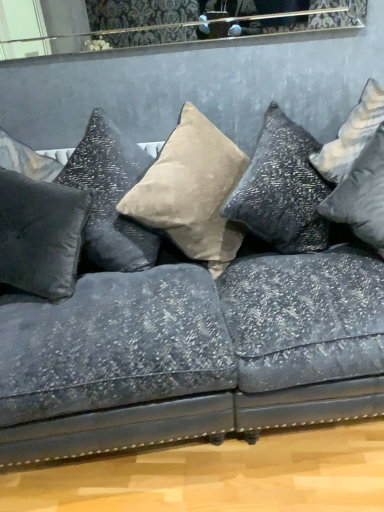
Question: Which direction should I rotate to look at suede beige pillow at center, which is counted as the third pillow, starting from the left?

Choices:
 (A) right
 (B) left

Answer: (B)

Question: Could satin black pillow at center, arranged as the 3th pillow when viewed from the right, be considered to be inside satin black pillow at left, which is counted as the first pillow, starting from the left?

Choices:
 (A) no
 (B) yes

Answer: (A)

Question: From the image's perspective, is satin black pillow at left, the fourth pillow in the right-to-left sequence, on satin black pillow at center, arranged as the 3th pillow when viewed from the right?

Choices:
 (A) yes
 (B) no

Answer: (B)

Question: Is satin black pillow at left, which is counted as the first pillow, starting from the left, smaller than satin black pillow at center, the 2th pillow when ordered from left to right?

Choices:
 (A) yes
 (B) no

Answer: (A)

Question: Can you confirm if satin black pillow at left, the fourth pillow in the right-to-left sequence, is thinner than satin black pillow at center, arranged as the 3th pillow when viewed from the right?

Choices:
 (A) no
 (B) yes

Answer: (B)

Question: Does satin black pillow at left, the fourth pillow in the right-to-left sequence, have a lesser height compared to satin black pillow at center, the 2th pillow when ordered from left to right?

Choices:
 (A) yes
 (B) no

Answer: (A)

Question: Is satin black pillow at left, which is counted as the first pillow, starting from the left, oriented away from satin black pillow at center, arranged as the 3th pillow when viewed from the right?

Choices:
 (A) no
 (B) yes

Answer: (B)

Question: Is silver metallic pillow at right, which is counted as the fourth pillow, starting from the left, wider than satin black pillow at left, which is counted as the first pillow, starting from the left?

Choices:
 (A) yes
 (B) no

Answer: (A)

Question: Is silver metallic pillow at right, which appears as the 1th pillow when viewed from the right, facing towards satin black pillow at left, the fourth pillow in the right-to-left sequence?

Choices:
 (A) no
 (B) yes

Answer: (A)

Question: Does silver metallic pillow at right, which appears as the 1th pillow when viewed from the right, have a greater height compared to satin black pillow at left, the fourth pillow in the right-to-left sequence?

Choices:
 (A) yes
 (B) no

Answer: (A)

Question: From the image's perspective, would you say silver metallic pillow at right, which appears as the 1th pillow when viewed from the right, is positioned over satin black pillow at left, the fourth pillow in the right-to-left sequence?

Choices:
 (A) yes
 (B) no

Answer: (A)

Question: From a real-world perspective, is silver metallic pillow at right, which appears as the 1th pillow when viewed from the right, located beneath satin black pillow at left, which is counted as the first pillow, starting from the left?

Choices:
 (A) yes
 (B) no

Answer: (A)

Question: Does silver metallic pillow at right, which is counted as the fourth pillow, starting from the left, have a lesser width compared to satin black pillow at left, which is counted as the first pillow, starting from the left?

Choices:
 (A) no
 (B) yes

Answer: (A)

Question: From a real-world perspective, does satin black pillow at left, the fourth pillow in the right-to-left sequence, stand above silver metallic pillow at right, which is counted as the fourth pillow, starting from the left?

Choices:
 (A) yes
 (B) no

Answer: (A)